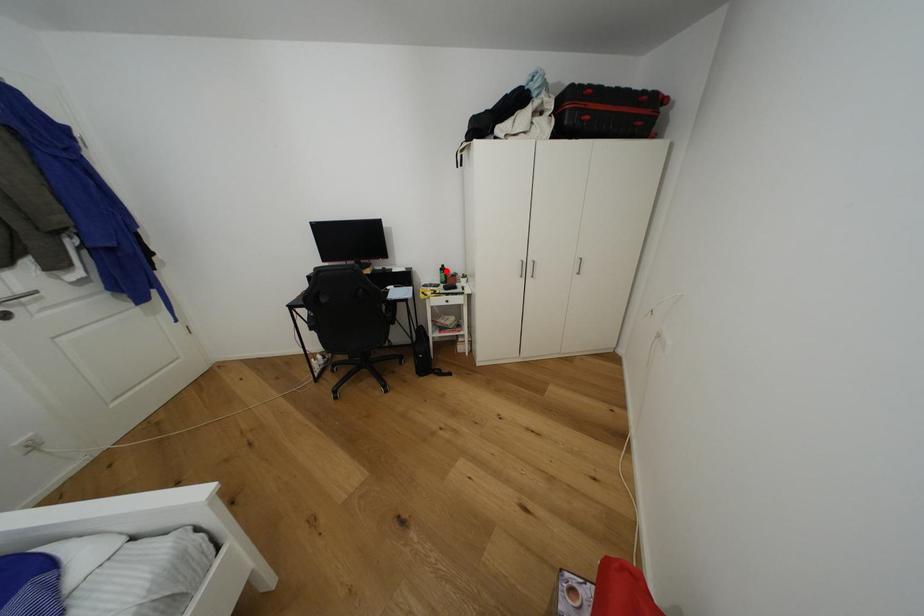
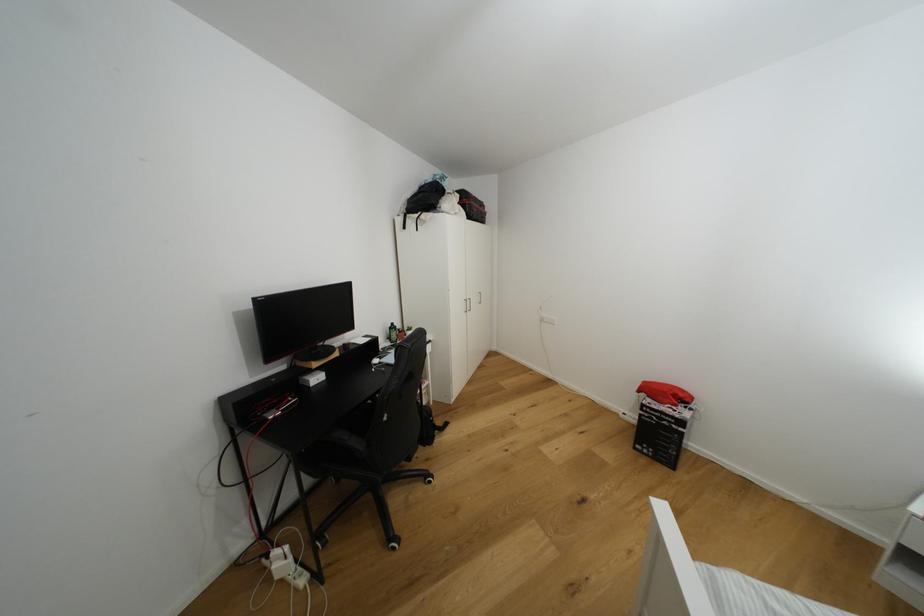
Question: I am providing you with two images of the same scene from different viewpoints. A red point is shown in image1. For the corresponding object point in image2, is it positioned nearer or farther from the camera?

Choices:
 (A) Nearer
 (B) Farther

Answer: (B)